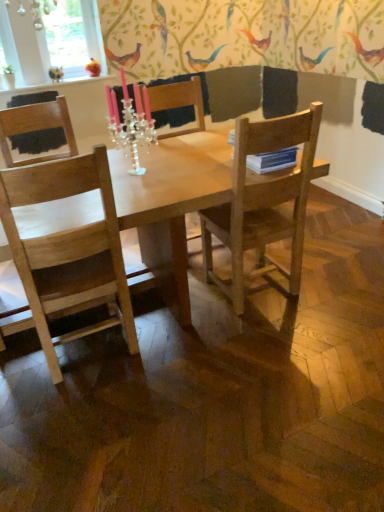
Question: Is wooden chair at right, marked as the 2th chair in a left-to-right arrangement, in front of or behind crystal clear candle holder at center in the image?

Choices:
 (A) behind
 (B) front

Answer: (B)

Question: From a real-world perspective, is wooden chair at right, the 1th chair when ordered from right to left, physically located above or below crystal clear candle holder at center?

Choices:
 (A) below
 (B) above

Answer: (A)

Question: Which object is the closest to the crystal clear candle holder at center?

Choices:
 (A) transparent glass window at upper left
 (B) wooden chair at center
 (C) wooden chair at left, the 1th chair positioned from the left
 (D) matte orange bird at upper left, placed as the 2th bird when sorted from left to right
 (E) light brown wooden table at center

Answer: (B)

Question: Based on their relative distances, which object is farther from the matte orange bird at upper left, arranged as the first bird when viewed from the right?

Choices:
 (A) transparent glass window at upper left
 (B) light brown wooden table at center
 (C) wooden chair at left, marked as the second chair in a right-to-left arrangement
 (D) wooden chair at right, the 1th chair when ordered from right to left
 (E) wooden chair at center

Answer: (D)